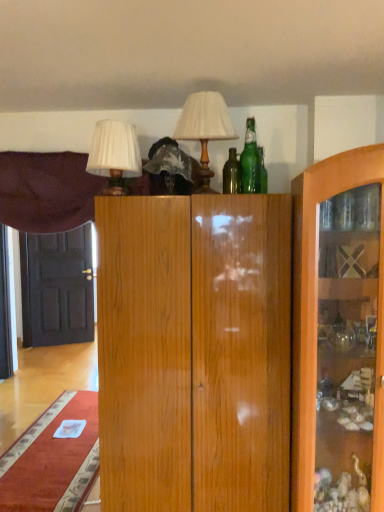
Question: From their relative heights in the image, would you say matte white lampshade at upper center, the 1th table lamp positioned from the right, is taller or shorter than white pleated shade at upper left, which appears as the first table lamp when viewed from the left?

Choices:
 (A) tall
 (B) short

Answer: (A)

Question: Considering the positions of matte white lampshade at upper center, arranged as the 2th table lamp when viewed from the left, and white pleated shade at upper left, which is the 2th table lamp from right to left, in the image, is matte white lampshade at upper center, arranged as the 2th table lamp when viewed from the left, wider or thinner than white pleated shade at upper left, which is the 2th table lamp from right to left,?

Choices:
 (A) thin
 (B) wide

Answer: (B)

Question: Estimate the real-world distances between objects in this image. Which object is farther from the black glossy door at left?

Choices:
 (A) white pleated shade at upper left, which is the 2th table lamp from right to left
 (B) green glass bottle at upper center
 (C) matte white lampshade at upper center, the 1th table lamp positioned from the right
 (D) velvet purple curtain at upper left

Answer: (B)

Question: Which object is positioned farthest from the black glossy door at left?

Choices:
 (A) green glass bottle at upper center
 (B) matte white lampshade at upper center, the 1th table lamp positioned from the right
 (C) white pleated shade at upper left, which appears as the first table lamp when viewed from the left
 (D) velvet purple curtain at upper left

Answer: (A)